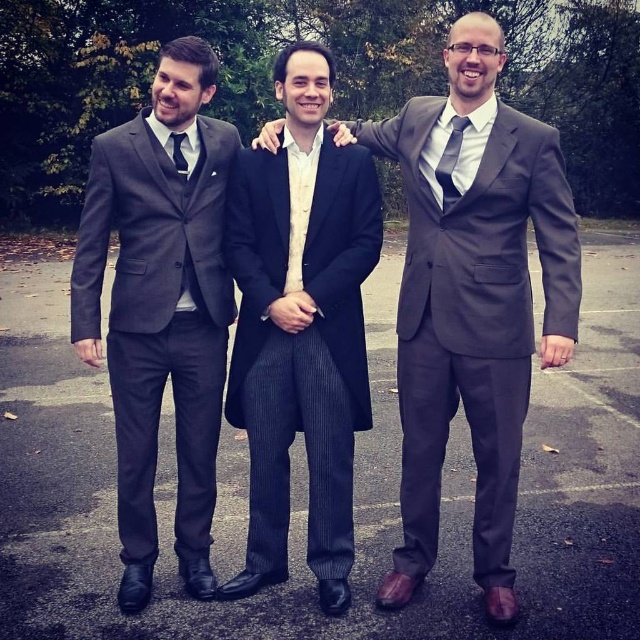
You are standing in the paved area and want to walk from point A to point B. Point A is at coordinate point(136, 358) and point B is at coordinate point(336, 328). Which point is closer to you when you start walking?

Point A at coordinate point(136, 358) is closer to you than point B at coordinate point(336, 328) because it is further to the viewer.